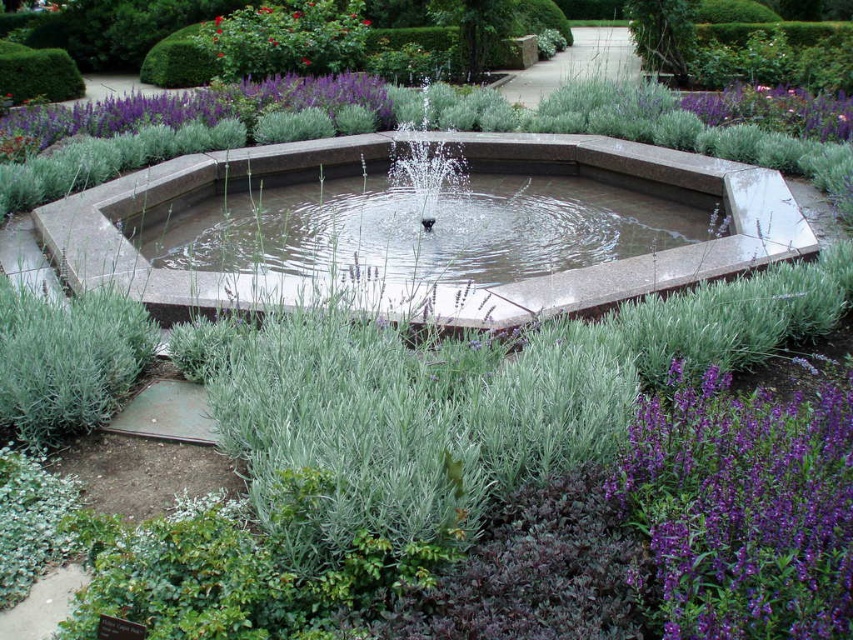
You are standing at the point marked as point [631,444] in the garden. The central water fountain is 2.06 meters away from you. Can you walk directly to the fountain without stepping on any of the lavender plants? Please explain your reasoning based on the garden layout described.

The central water fountain is 2.06 meters away from point [631,444]. Since the garden layout describes the fountain as the central feature surrounded by a lush bed of lavender plants, there is likely a clear path to the fountain from any surrounding point. However, the exact path depends on the arrangement of the lavender plants. Without specific details on their spacing, it is possible but not certain that you can walk directly to the fountain without stepping on the lavender plants.